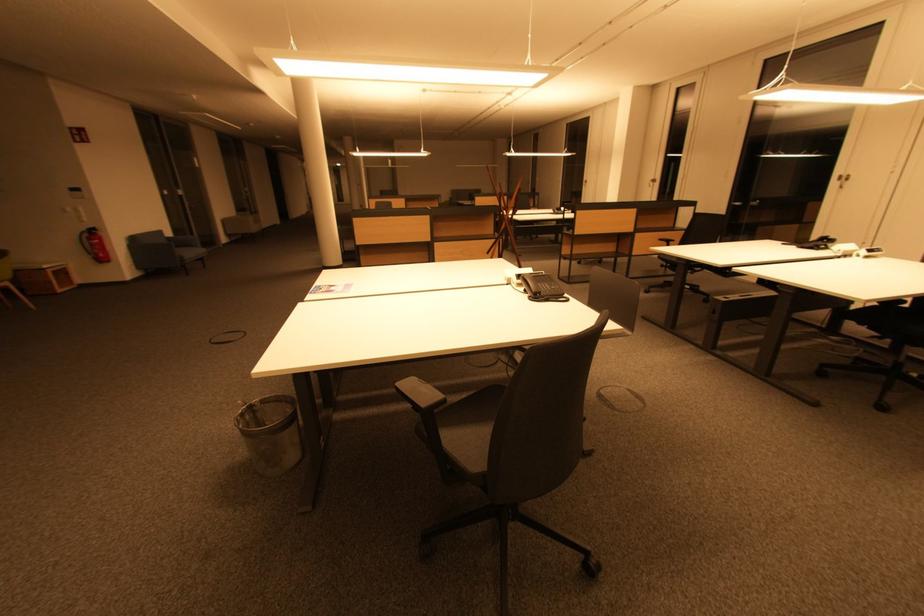
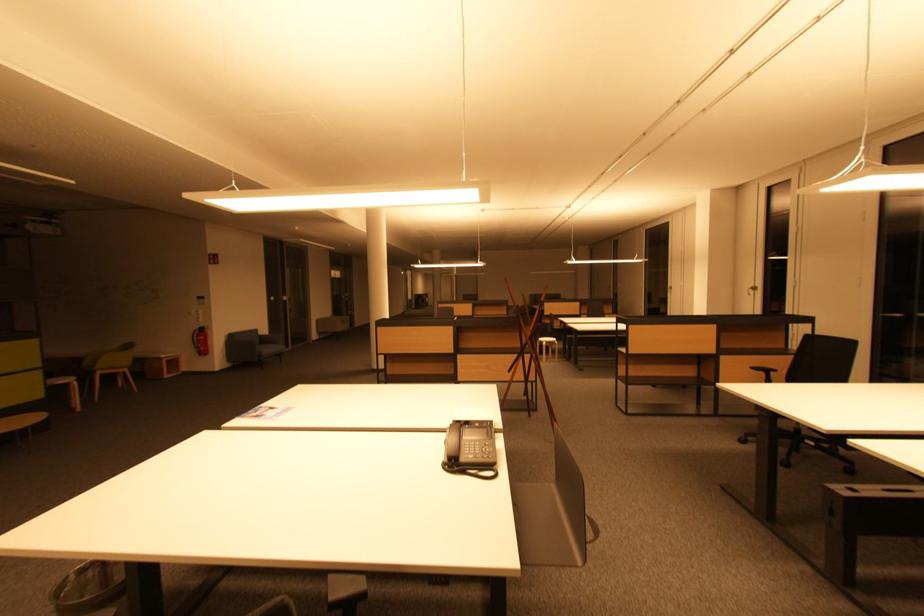
The point at (193, 256) is marked in the first image. Where is the corresponding point in the second image?

(272, 352)